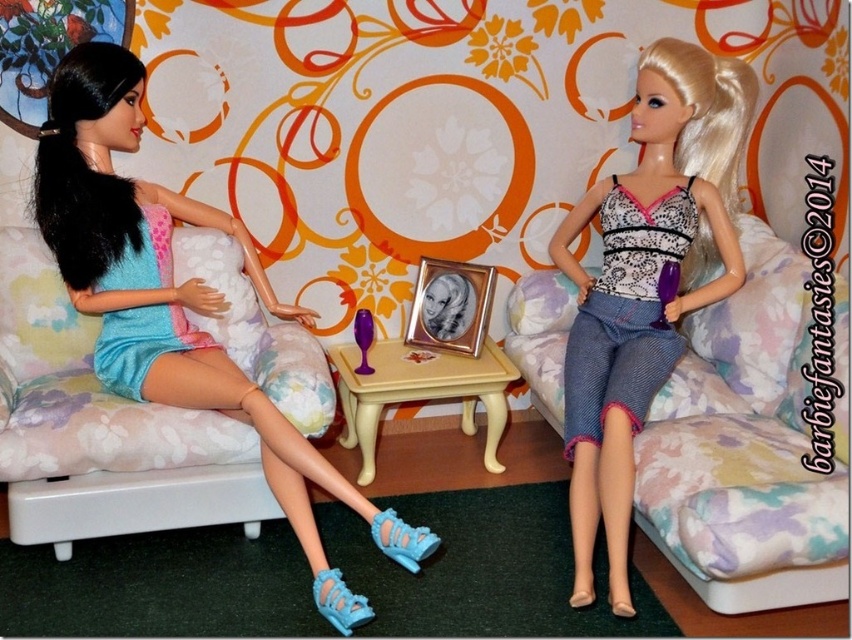
Question: From the image, what is the correct spatial relationship of matte blue dress at left in relation to denim shorts at right?

Choices:
 (A) right
 (B) left

Answer: (B)

Question: Which object is the farthest from the floral fabric couch at left?

Choices:
 (A) floral fabric couch at right
 (B) matte blue dress at left
 (C) denim shorts at right

Answer: (A)

Question: Which is farther from the matte blue dress at left?

Choices:
 (A) denim shorts at right
 (B) floral fabric couch at left
 (C) floral fabric couch at right

Answer: (C)

Question: Can you confirm if floral fabric couch at left is bigger than denim shorts at right?

Choices:
 (A) yes
 (B) no

Answer: (B)

Question: Does floral fabric couch at right have a lesser width compared to matte blue dress at left?

Choices:
 (A) no
 (B) yes

Answer: (B)

Question: Considering the real-world distances, which object is farthest from the floral fabric couch at right?

Choices:
 (A) floral fabric couch at left
 (B) matte blue dress at left

Answer: (A)